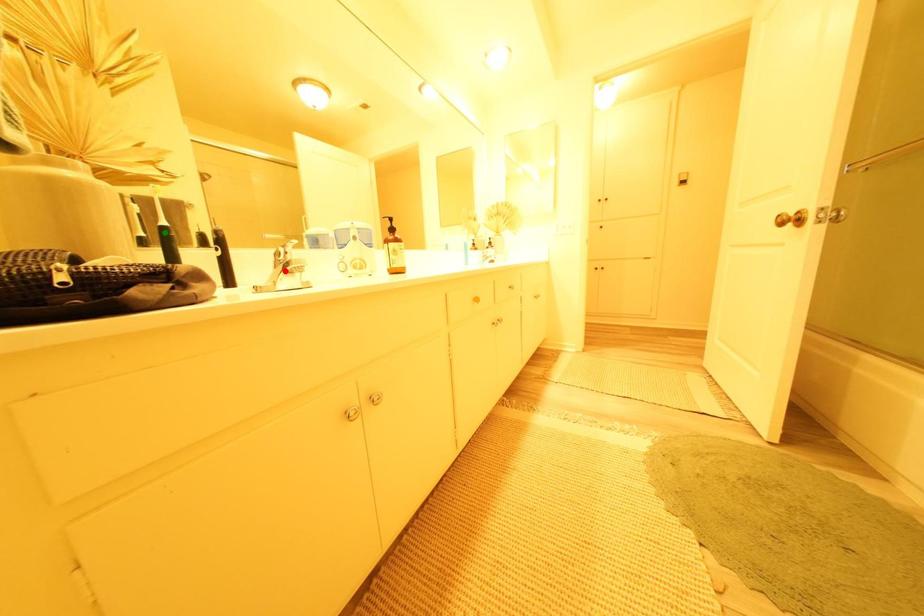
Order these from nearest to farthest:
A) orange point
B) red point
C) green point

orange point → red point → green point